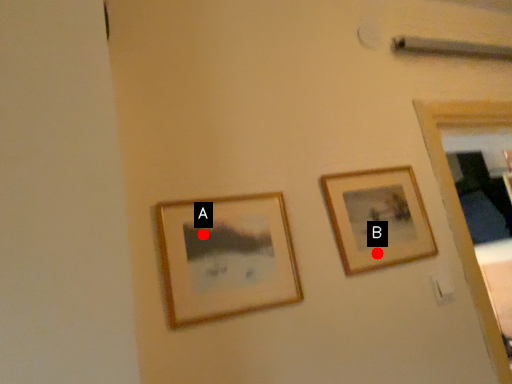
Question: Two points are circled on the image, labeled by A and B beside each circle. Which point appears closest to the camera in this image?

Choices:
 (A) A is closer
 (B) B is closer

Answer: (A)